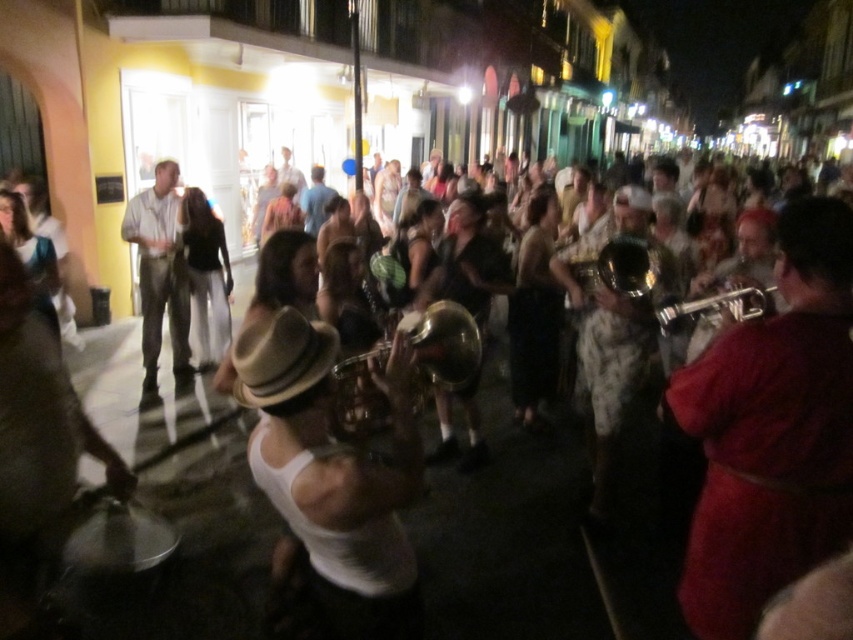
Can you confirm if white matte tank top at center is positioned below shiny brass trumpet at center right?

Indeed, white matte tank top at center is positioned under shiny brass trumpet at center right.

Is point (314, 508) positioned in front of point (706, 307)?

Yes, it is in front of point (706, 307).

Between point (398, 608) and point (666, 312), which one is positioned in front?

Positioned in front is point (398, 608).

This screenshot has width=853, height=640. In order to click on white matte tank top at center in this screenshot , I will do `click(334, 476)`.

Does point (437, 355) come farther from viewer compared to point (318, 186)?

No, (437, 355) is in front of (318, 186).

Is shiny brass trumpet at center closer to the viewer compared to blue denim shirt at center?

Yes, shiny brass trumpet at center is in front of blue denim shirt at center.

Based on the photo, who is more forward, (421, 360) or (303, 216)?

Point (421, 360) is more forward.

At what (x,y) coordinates should I click in order to perform the action: click on shiny brass trumpet at center. Please return your answer as a coordinate pair (x, y). Image resolution: width=853 pixels, height=640 pixels. Looking at the image, I should click on (444, 342).

Can you confirm if shiny red trumpet at center is positioned above patterned fabric pants at center?

No, shiny red trumpet at center is not above patterned fabric pants at center.

Does shiny red trumpet at center have a smaller size compared to patterned fabric pants at center?

Indeed, shiny red trumpet at center has a smaller size compared to patterned fabric pants at center.

This screenshot has width=853, height=640. What are the coordinates of `shiny red trumpet at center` in the screenshot? It's located at (772, 432).